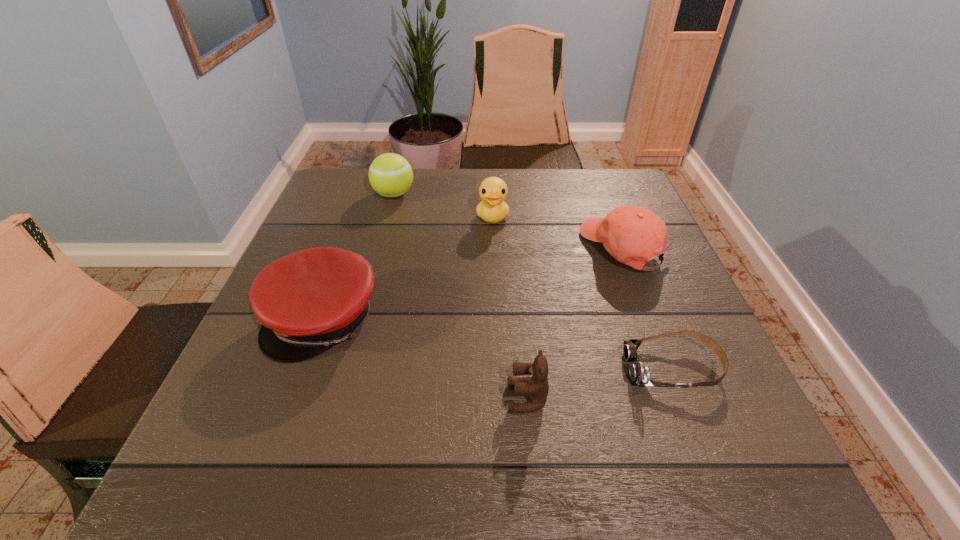
Where is `vacant area between the shortest object and the teddy bear`? This screenshot has width=960, height=540. vacant area between the shortest object and the teddy bear is located at coordinates (600, 383).

Identify the location of free spot between the tennis ball and the duck. (444, 206).

This screenshot has width=960, height=540. Identify the location of vacant space that is in between the baseball cap and the tennis ball. (509, 221).

Find the location of a particular element. The height and width of the screenshot is (540, 960). empty location between the duck and the goggles is located at coordinates (583, 293).

I want to click on free spot between the teddy bear and the tennis ball, so click(x=461, y=296).

Locate an element on the screen. This screenshot has height=540, width=960. empty space between the duck and the shortest object is located at coordinates (583, 293).

Image resolution: width=960 pixels, height=540 pixels. In order to click on vacant space that's between the duck and the cap in this screenshot , I will do `click(408, 268)`.

I want to click on free spot between the duck and the goggles, so click(x=583, y=293).

Identify which object is the fourth closest to the baseball cap. Please provide its 2D coordinates. Your answer should be formatted as a tuple, i.e. [(x, y)], where the tuple contains the x and y coordinates of a point satisfying the conditions above.

[(390, 175)]

Locate an element on the screen. Image resolution: width=960 pixels, height=540 pixels. object that is the second closest one to the baseball cap is located at coordinates (639, 374).